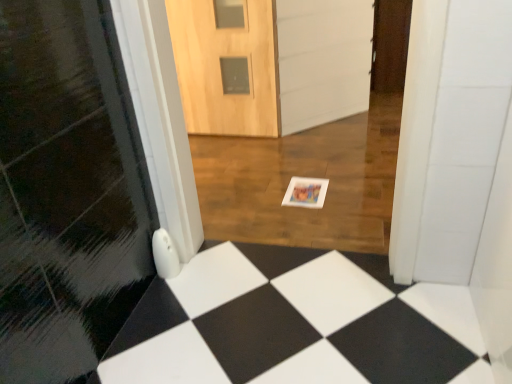
Question: Is wooden door at center not close to white matte postcard at center?

Choices:
 (A) no
 (B) yes

Answer: (A)

Question: From the image's perspective, is wooden door at center on white matte postcard at center?

Choices:
 (A) yes
 (B) no

Answer: (A)

Question: Is wooden door at center closer to the viewer compared to white matte postcard at center?

Choices:
 (A) no
 (B) yes

Answer: (A)

Question: Is wooden door at center taller than white matte postcard at center?

Choices:
 (A) no
 (B) yes

Answer: (B)

Question: From a real-world perspective, is wooden door at center under white matte postcard at center?

Choices:
 (A) no
 (B) yes

Answer: (A)

Question: Considering the relative sizes of wooden door at center and white matte postcard at center in the image provided, is wooden door at center shorter than white matte postcard at center?

Choices:
 (A) yes
 (B) no

Answer: (B)

Question: Is white matte postcard at center oriented towards wooden door at center?

Choices:
 (A) yes
 (B) no

Answer: (B)

Question: From a real-world perspective, is white matte postcard at center on wooden door at center?

Choices:
 (A) yes
 (B) no

Answer: (B)

Question: Can you confirm if white matte postcard at center is taller than wooden door at center?

Choices:
 (A) yes
 (B) no

Answer: (B)

Question: From a real-world perspective, is white matte postcard at center under wooden door at center?

Choices:
 (A) no
 (B) yes

Answer: (B)

Question: Would you say white matte postcard at center is outside wooden door at center?

Choices:
 (A) no
 (B) yes

Answer: (B)

Question: From the image's perspective, is white matte postcard at center beneath wooden door at center?

Choices:
 (A) no
 (B) yes

Answer: (B)

Question: From a real-world perspective, relative to white matte postcard at center, is wooden door at center vertically above or below?

Choices:
 (A) above
 (B) below

Answer: (A)